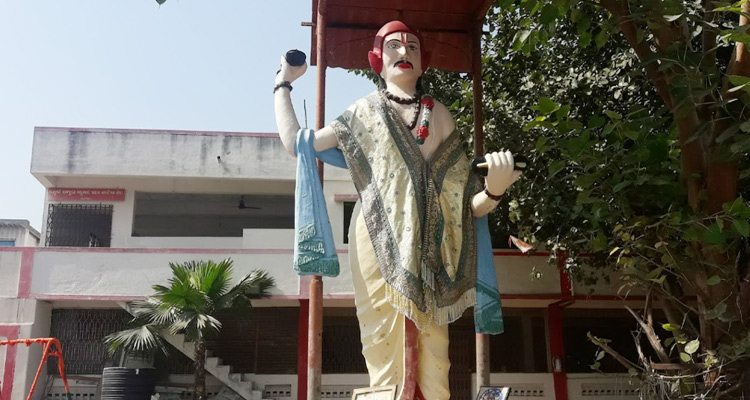
Locate an element on the screen. The width and height of the screenshot is (750, 400). statue is located at coordinates (411, 58).